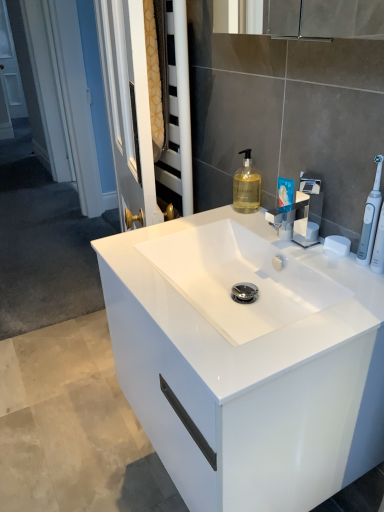
Find the location of a particular element. The width and height of the screenshot is (384, 512). vacant area that is in front of translucent yellow liquid at center is located at coordinates (254, 223).